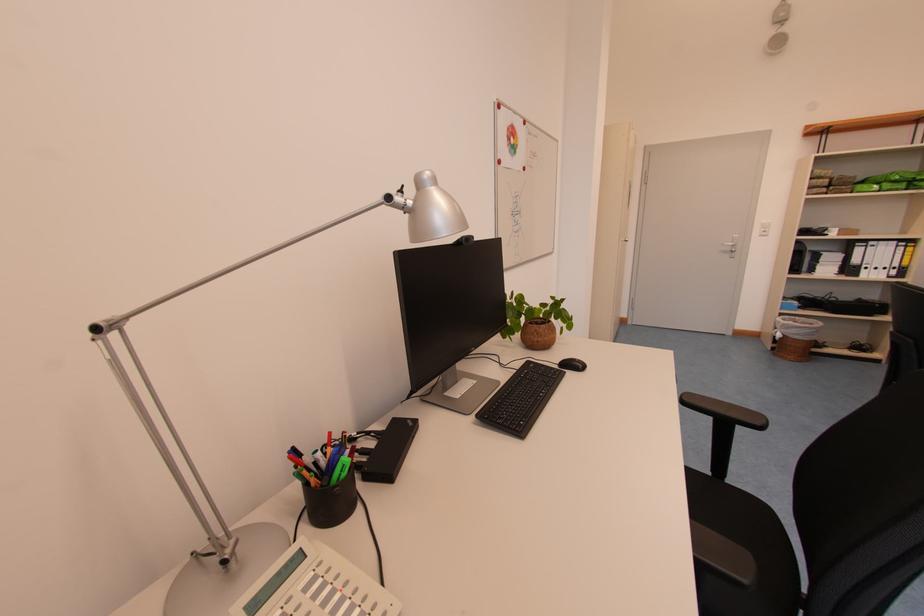
Find where to rotat the silver lamp head. Please return your answer as a coordinate pair (x, y).

(429, 209)